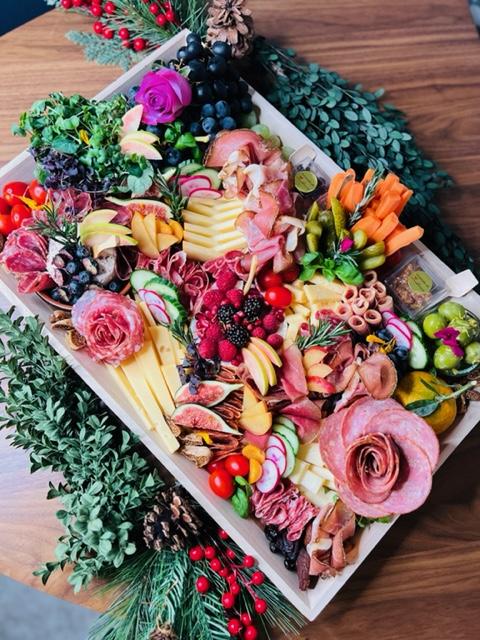
Locate an element on the screen. Image resolution: width=480 pixels, height=640 pixels. brown table is located at coordinates (23, 513), (428, 580), (426, 61).